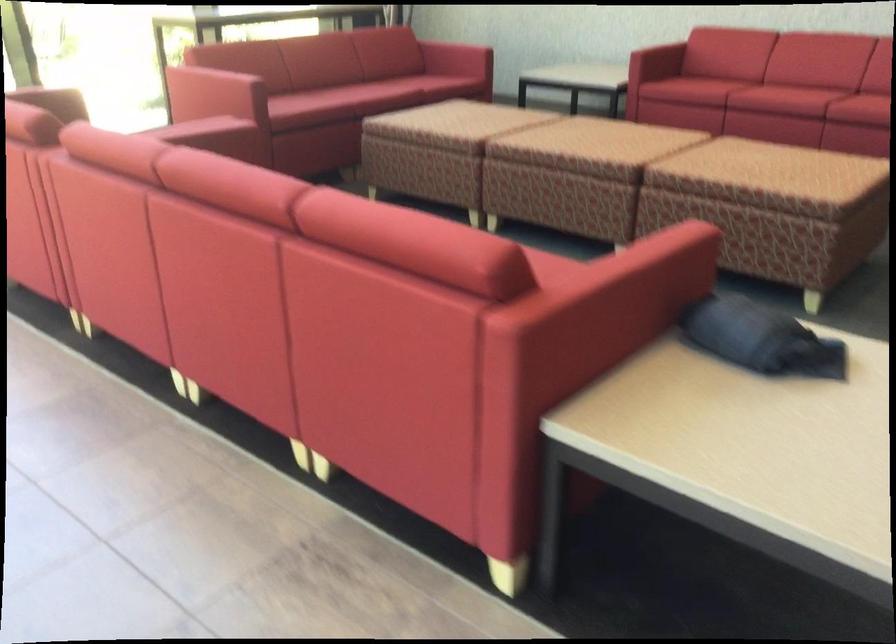
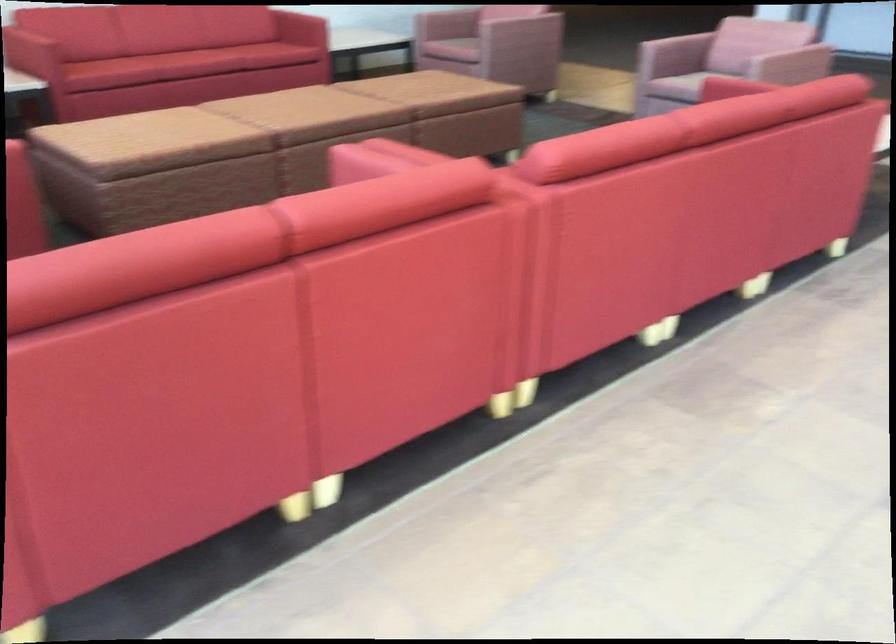
Question: The images are taken continuously from a first-person perspective. In which direction are you moving?

Choices:
 (A) Left
 (B) Right
 (C) Forward
 (D) Backward

Answer: (D)